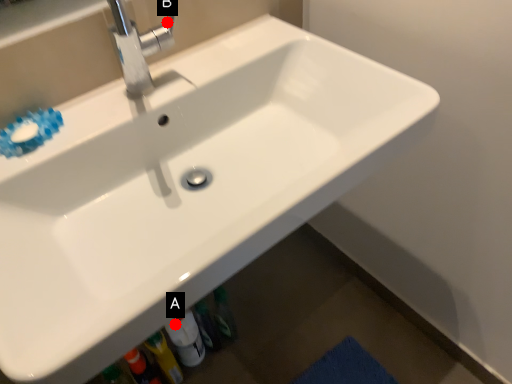
Question: Two points are circled on the image, labeled by A and B beside each circle. Which point appears farthest from the camera in this image?

Choices:
 (A) A is further
 (B) B is further

Answer: (A)